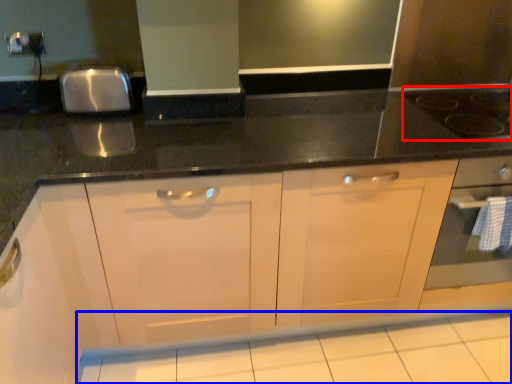
Question: Which object appears farthest to the camera in this image, gas stove (highlighted by a red box) or tile (highlighted by a blue box)?

Choices:
 (A) gas stove
 (B) tile

Answer: (A)